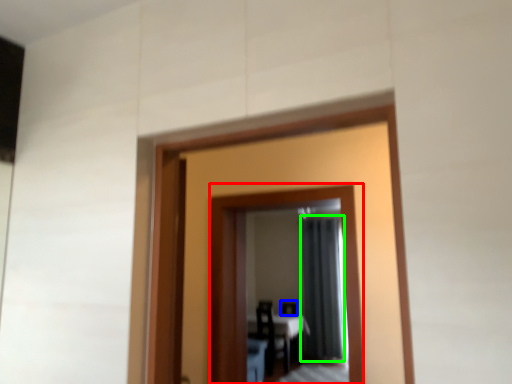
Question: Considering the real-world distances, which object is closest to mirror (highlighted by a red box)? chair (highlighted by a blue box) or curtain (highlighted by a green box).

Choices:
 (A) chair
 (B) curtain

Answer: (B)